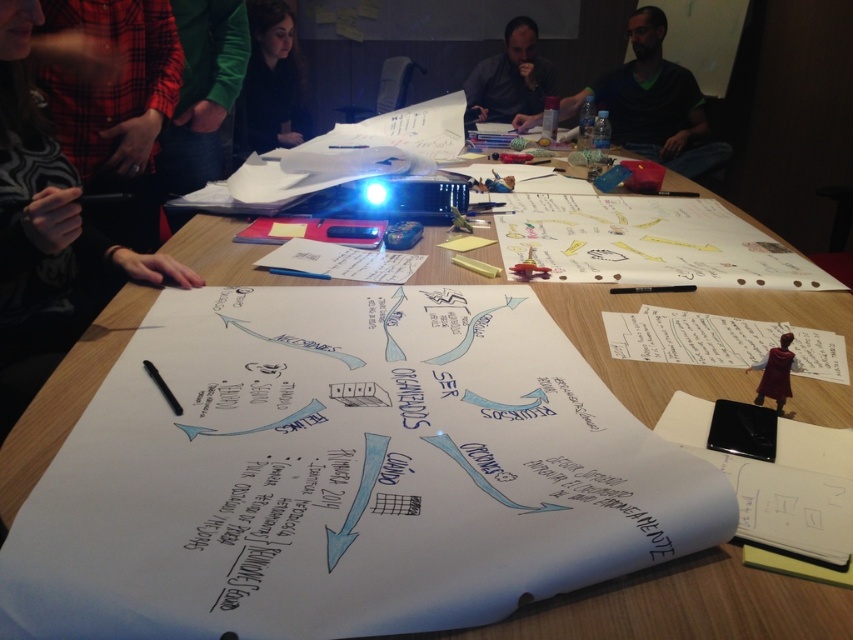
Question: Does matte black hair at upper center have a greater width compared to red velvet cape at lower right?

Choices:
 (A) yes
 (B) no

Answer: (A)

Question: Estimate the real-world distances between objects in this image. Which object is closer to the black plastic pen at center?

Choices:
 (A) dark gray shirt at center
 (B) matte black hair at upper center

Answer: (B)

Question: Which of these objects is positioned closest to the dark gray shirt at center?

Choices:
 (A) plaid fabric shirt at upper left
 (B) red velvet cape at lower right

Answer: (A)

Question: Does red velvet cape at lower right appear on the right side of black plastic pen at center?

Choices:
 (A) no
 (B) yes

Answer: (B)

Question: Which object appears farthest from the camera in this image?

Choices:
 (A) black plastic pen at center
 (B) matte black hair at upper center
 (C) green sweater at upper right

Answer: (C)

Question: Does matte black hair at upper center appear over black plastic pen at center?

Choices:
 (A) yes
 (B) no

Answer: (A)